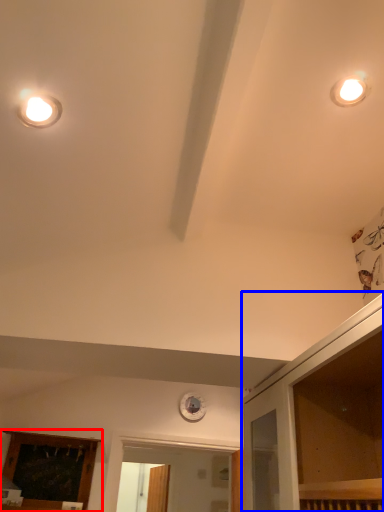
Question: Which of the following is the farthest to the observer, elevator (highlighted by a red box) or dresser (highlighted by a blue box)?

Choices:
 (A) elevator
 (B) dresser

Answer: (A)